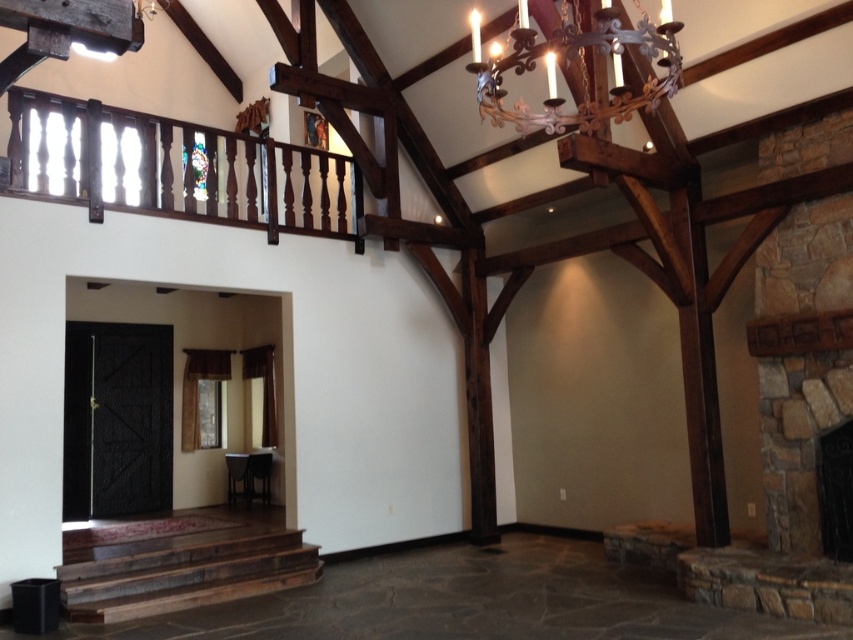
Question: Which point appears closest to the camera in this image?

Choices:
 (A) coord(70,141)
 (B) coord(476,22)
 (C) coord(839,435)
 (D) coord(161,596)

Answer: (B)

Question: Which object is farther from the camera taking this photo?

Choices:
 (A) wrought iron chandelier at upper center
 (B) rustic wood stairs at lower left
 (C) dark wood balustrade at upper left
 (D) dark stone fireplace at right

Answer: (B)

Question: Can you confirm if rustic wood stairs at lower left is positioned below dark stone fireplace at right?

Choices:
 (A) no
 (B) yes

Answer: (B)

Question: Does dark wood balustrade at upper left appear under rustic wood stairs at lower left?

Choices:
 (A) no
 (B) yes

Answer: (A)

Question: Which object is farther from the camera taking this photo?

Choices:
 (A) dark wood balustrade at upper left
 (B) rustic wood stairs at lower left
 (C) wrought iron chandelier at upper center
 (D) dark stone fireplace at right

Answer: (B)

Question: In this image, where is dark wood balustrade at upper left located relative to dark stone fireplace at right?

Choices:
 (A) right
 (B) left

Answer: (B)